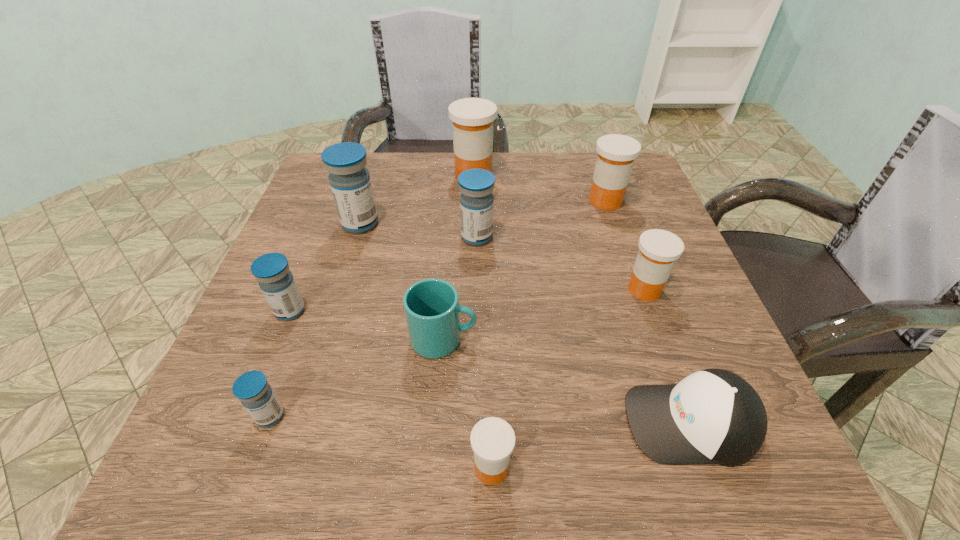
You are a GUI agent. You are given a task and a screenshot of the screen. Output one action in this format:
    pyautogui.click(x=<x>, y=<y>)
    Task: Click on the vacant space located 0.160m on the label of the second smallest orange medicine
    The image size is (960, 540).
    Given the screenshot: What is the action you would take?
    pyautogui.click(x=543, y=289)

Where is `free point located on the label of the second smallest orange medicine`? free point located on the label of the second smallest orange medicine is located at coordinates (528, 289).

You are a GUI agent. You are given a task and a screenshot of the screen. Output one action in this format:
    pyautogui.click(x=<x>, y=<y>)
    Task: Click on the free space located on the back of the third farthest blue medicine
    
    Given the screenshot: What is the action you would take?
    pyautogui.click(x=340, y=185)

Image resolution: width=960 pixels, height=540 pixels. What are the coordinates of `vacant region located 0.080m on the handle side of the cup` in the screenshot? It's located at (522, 340).

Find the location of a particular element. Image resolution: width=960 pixels, height=540 pixels. blank space located 0.220m on the front panel of the cap is located at coordinates (480, 422).

The image size is (960, 540). In order to click on free region located 0.360m on the front panel of the cap in this screenshot , I will do `click(388, 422)`.

Locate an element on the screen. vacant position located 0.100m on the front panel of the cap is located at coordinates (560, 422).

Locate an element on the screen. This screenshot has width=960, height=540. blank area located 0.150m on the right of the nearest blue medicine is located at coordinates (383, 416).

You are a GUI agent. You are given a task and a screenshot of the screen. Output one action in this format:
    pyautogui.click(x=<x>, y=<y>)
    Task: Click on the free point located on the label of the nearest medicine
    
    Given the screenshot: What is the action you would take?
    pyautogui.click(x=201, y=468)

Image resolution: width=960 pixels, height=540 pixels. What are the coordinates of `vacant space located 0.060m on the label of the nearest medicine` in the screenshot? It's located at (428, 468).